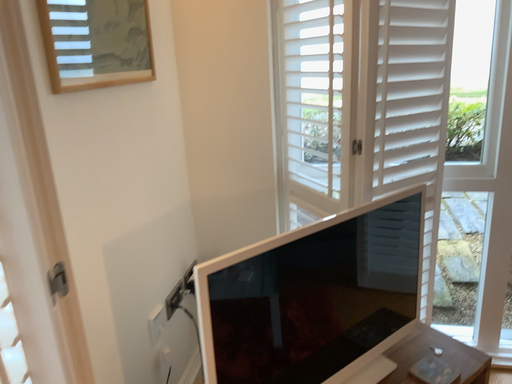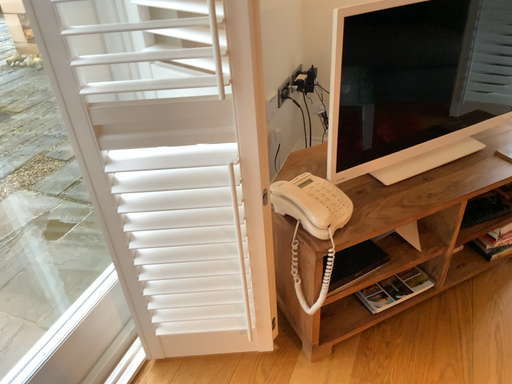
Question: Which way did the camera rotate in the video?

Choices:
 (A) rotated right
 (B) rotated left

Answer: (B)